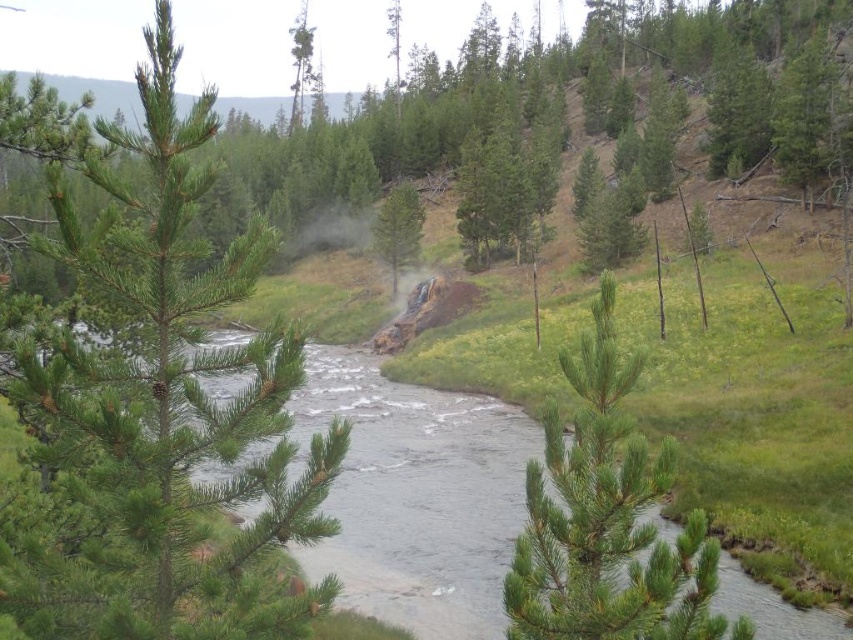
Does green pine tree at upper right have a smaller size compared to green matte tree at upper center?

Correct, green pine tree at upper right occupies less space than green matte tree at upper center.

Can you confirm if green pine tree at upper right is thinner than green matte tree at upper center?

Correct, green pine tree at upper right's width is less than green matte tree at upper center's.

At what (x,y) coordinates should I click in order to perform the action: click on green pine tree at upper right. Please return your answer as a coordinate pair (x, y). This screenshot has height=640, width=853. Looking at the image, I should click on (807, 116).

Does clear water at center have a greater height compared to green needle-like tree at center?

No.

Is clear water at center to the left of green needle-like tree at center from the viewer's perspective?

Indeed, clear water at center is positioned on the left side of green needle-like tree at center.

Which is behind, point (450, 460) or point (627, 378)?

Point (450, 460)

This screenshot has width=853, height=640. Find the location of `clear water at center`. clear water at center is located at coordinates (416, 496).

Can you confirm if green needle-like pine at center is wider than green pine tree at upper right?

No, green needle-like pine at center is not wider than green pine tree at upper right.

Locate an element on the screen. The width and height of the screenshot is (853, 640). green needle-like pine at center is located at coordinates (167, 416).

In order to click on green needle-like pine at center in this screenshot , I will do `click(167, 416)`.